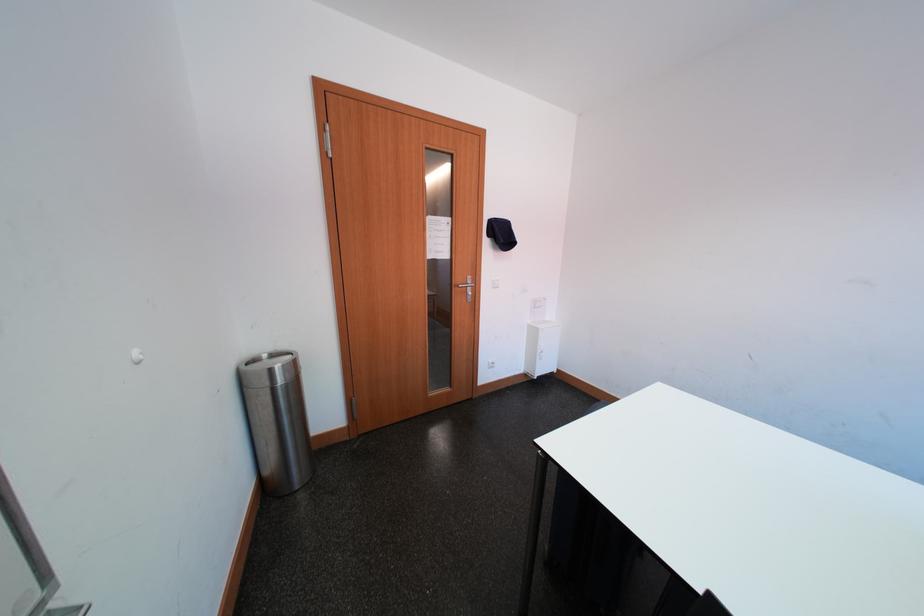
Find the location of `white light switch`. white light switch is located at coordinates (494, 283).